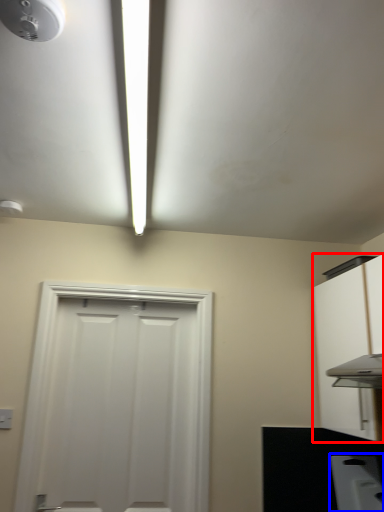
Question: Which object appears farthest to the camera in this image, cabinetry (highlighted by a red box) or appliance (highlighted by a blue box)?

Choices:
 (A) cabinetry
 (B) appliance

Answer: (B)